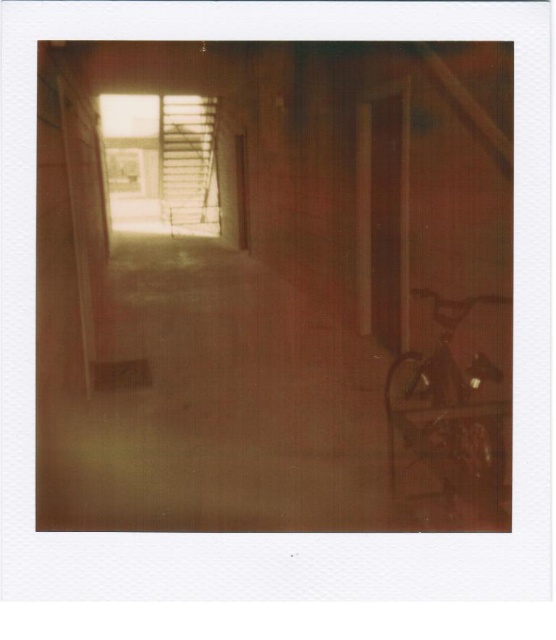
Does point (451, 42) lie behind point (459, 355)?

No, it is not.

Between matte concrete corridor at center and wooden rocking chair at right, which one appears on the left side from the viewer's perspective?

matte concrete corridor at center

Is point (220, 400) behind point (411, 474)?

Yes, point (220, 400) is farther from viewer.

You are a GUI agent. You are given a task and a screenshot of the screen. Output one action in this format:
    pyautogui.click(x=<x>, y=<y>)
    Task: Click on the matte concrete corridor at center
    The height and width of the screenshot is (640, 556).
    Given the screenshot: What is the action you would take?
    pyautogui.click(x=275, y=285)